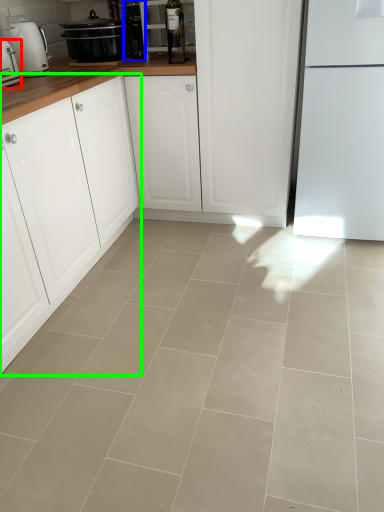
Question: Which is farther away from kitchen appliance (highlighted by a red box)? appliance (highlighted by a blue box) or cabinetry (highlighted by a green box)?

Choices:
 (A) appliance
 (B) cabinetry

Answer: (A)